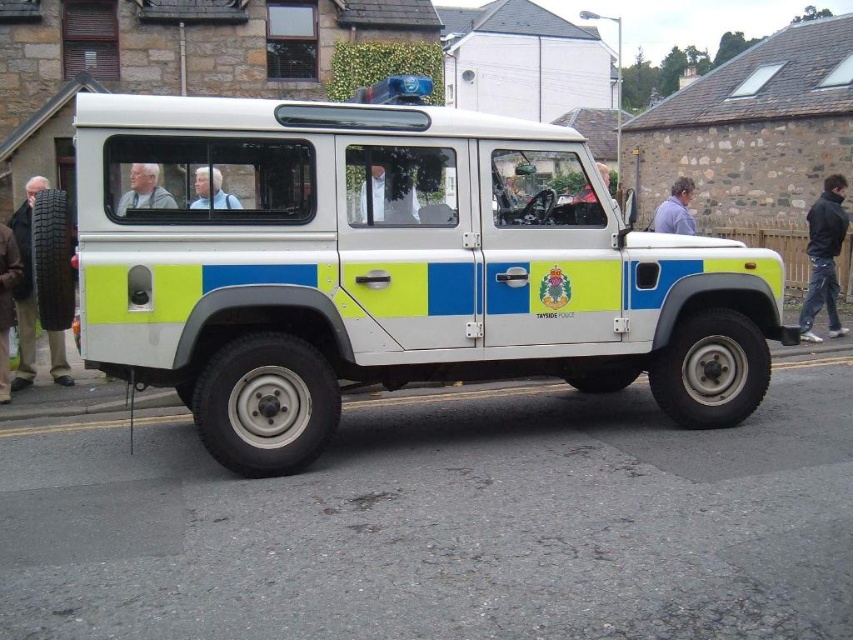
Question: Considering the relative positions of blue shirt at center and light blue shirt at center in the image provided, where is blue shirt at center located with respect to light blue shirt at center?

Choices:
 (A) above
 (B) below

Answer: (A)

Question: Which is nearer to the gray hair at center?

Choices:
 (A) matte white shirt at center
 (B) white matte vehicle at center

Answer: (B)

Question: Which of the following is the farthest from the observer?

Choices:
 (A) (22, 371)
 (B) (0, 236)
 (C) (136, 188)
 (D) (241, 204)

Answer: (A)

Question: Which point is closer to the camera?

Choices:
 (A) (225, 204)
 (B) (143, 177)

Answer: (B)

Question: Can you confirm if black leather jacket at right is wider than white fabric shirt at center?

Choices:
 (A) yes
 (B) no

Answer: (A)

Question: Can you confirm if light brown leather jacket at left is positioned to the left of matte white shirt at center?

Choices:
 (A) yes
 (B) no

Answer: (A)